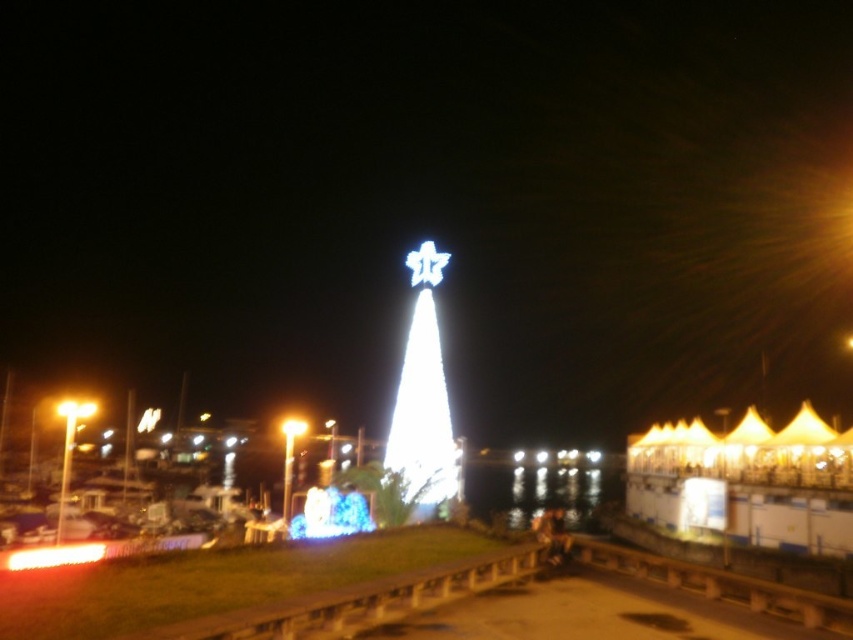
Question: Which of the following is the farthest from the observer?

Choices:
 (A) (286, 417)
 (B) (421, 387)

Answer: (A)

Question: Does white illuminated cone at center appear under matte yellow light at center?

Choices:
 (A) no
 (B) yes

Answer: (A)

Question: Observing the image, what is the correct spatial positioning of white illuminated cone at center in reference to matte yellow light at center?

Choices:
 (A) above
 (B) below

Answer: (A)

Question: Which point appears closest to the camera in this image?

Choices:
 (A) (432, 381)
 (B) (285, 432)

Answer: (A)

Question: Can you confirm if white illuminated cone at center is thinner than matte yellow light at center?

Choices:
 (A) yes
 (B) no

Answer: (B)

Question: Which point is farther to the camera?

Choices:
 (A) (447, 483)
 (B) (297, 433)

Answer: (B)